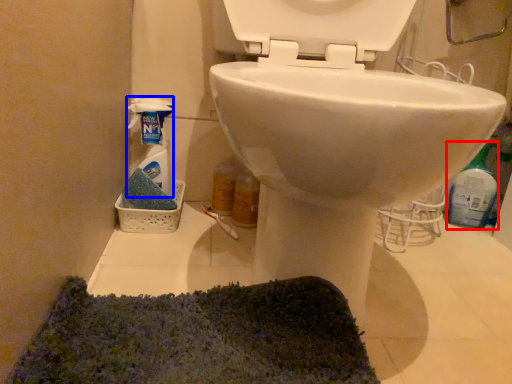
Question: Which object is further to the camera taking this photo, cleaning product (highlighted by a red box) or cleaning product (highlighted by a blue box)?

Choices:
 (A) cleaning product
 (B) cleaning product

Answer: (A)